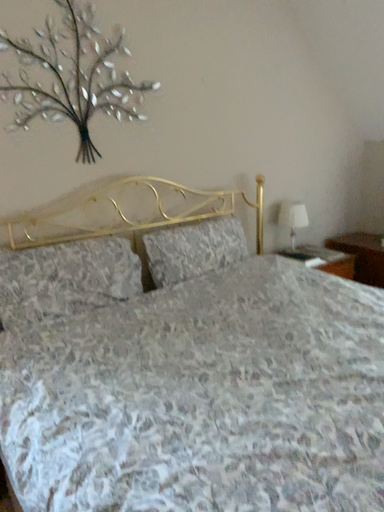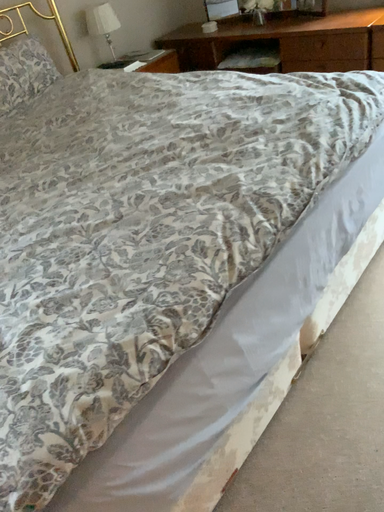
Question: Which way did the camera rotate in the video?

Choices:
 (A) rotated upward
 (B) rotated downward

Answer: (B)